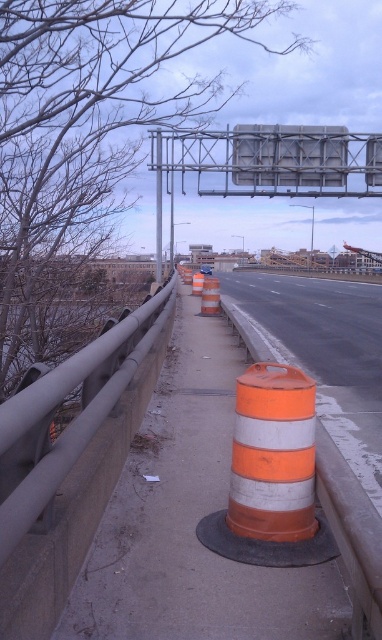
Which is below, orange striped barrel at center or metallic gray sign at upper center?

Positioned lower is orange striped barrel at center.

Who is taller, orange striped barrel at center or metallic gray sign at upper center?

metallic gray sign at upper center

Between point (12, 588) and point (333, 128), which one is positioned in front?

Point (12, 588) is more forward.

You are a GUI agent. You are given a task and a screenshot of the screen. Output one action in this format:
    pyautogui.click(x=<x>, y=<y>)
    Task: Click on the orange striped barrel at center
    This screenshot has height=640, width=382.
    Given the screenshot: What is the action you would take?
    pyautogui.click(x=69, y=461)

Does orange striped barrel at center come in front of orange striped cone at center?

Yes, it is.

Who is positioned more to the left, orange striped barrel at center or orange striped cone at center?

From the viewer's perspective, orange striped barrel at center appears more on the left side.

Is point (67, 364) positioned after point (199, 280)?

That is False.

Image resolution: width=382 pixels, height=640 pixels. I want to click on orange striped barrel at center, so click(69, 461).

Based on the photo, is orange/white striped traffic cone at center below orange striped cone at center?

Yes.

Is orange/white striped traffic cone at center thinner than orange striped cone at center?

Incorrect, orange/white striped traffic cone at center's width is not less than orange striped cone at center's.

Describe the element at coordinates (270, 476) in the screenshot. I see `orange/white striped traffic cone at center` at that location.

The image size is (382, 640). What are the coordinates of `orange/white striped traffic cone at center` in the screenshot? It's located at (270, 476).